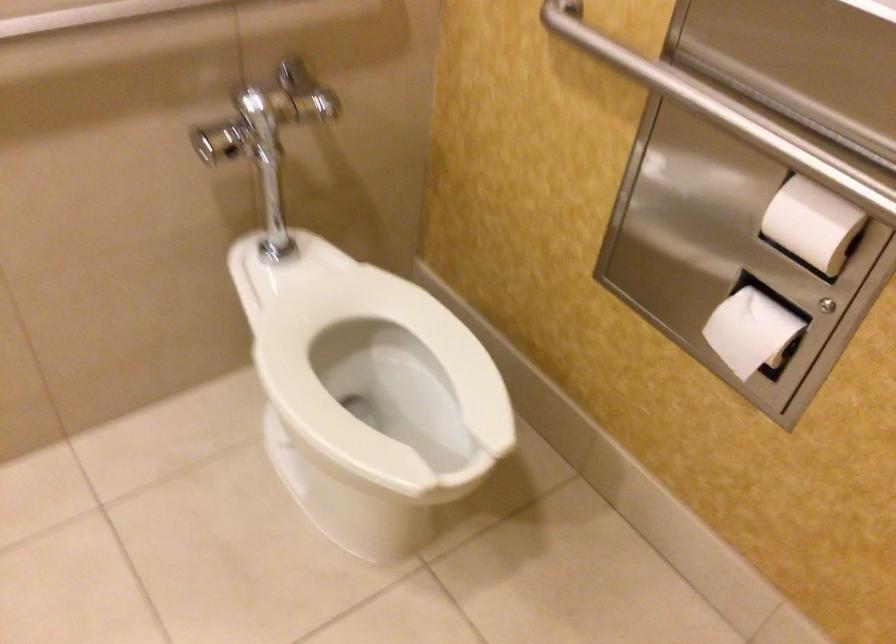
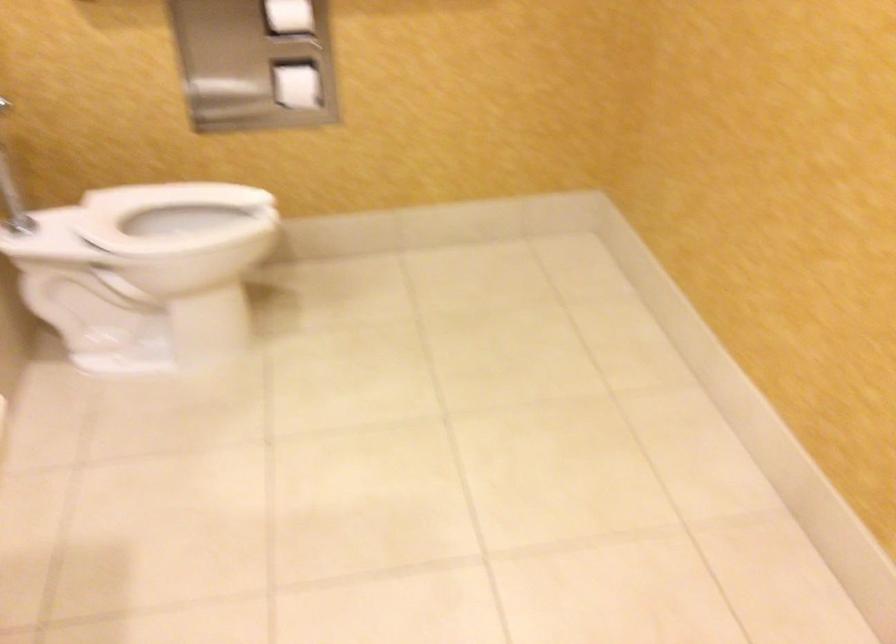
Locate, in the second image, the point that corresponds to (728,326) in the first image.

(297, 86)